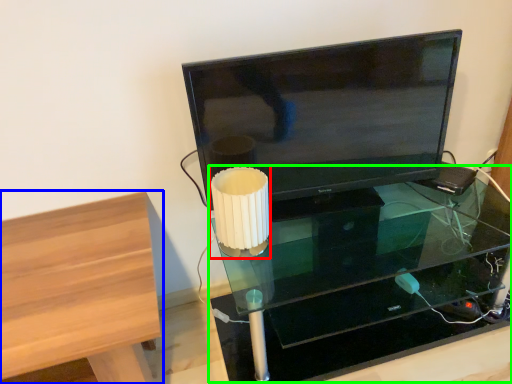
Question: Estimate the real-world distances between objects in this image. Which object is farther from table lamp (highlighted by a red box), furniture (highlighted by a blue box) or table (highlighted by a green box)?

Choices:
 (A) furniture
 (B) table

Answer: (B)